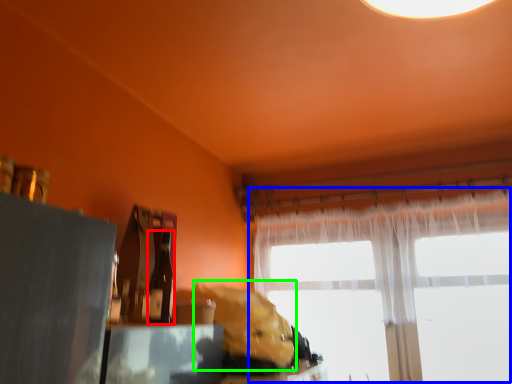
Question: Which object is positioned farthest from bottle (highlighted by a red box)? Select from window (highlighted by a blue box) and animal (highlighted by a green box).

Choices:
 (A) window
 (B) animal

Answer: (A)